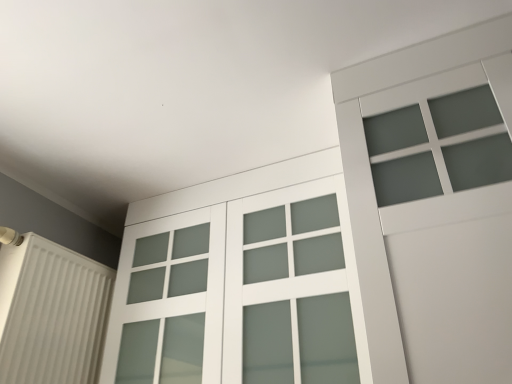
Question: Is satin white glass door at center in front of or behind white matte radiator at left in the image?

Choices:
 (A) behind
 (B) front

Answer: (B)

Question: Considering the positions of point (131, 314) and point (41, 244), is point (131, 314) closer or farther from the camera than point (41, 244)?

Choices:
 (A) farther
 (B) closer

Answer: (A)

Question: From a real-world perspective, is satin white glass door at center physically located above or below white matte radiator at left?

Choices:
 (A) below
 (B) above

Answer: (B)

Question: Is white matte radiator at left in front of or behind satin white glass door at center in the image?

Choices:
 (A) front
 (B) behind

Answer: (B)

Question: From the image's perspective, is white matte radiator at left positioned above or below satin white glass door at center?

Choices:
 (A) below
 (B) above

Answer: (A)

Question: Is white matte radiator at left taller or shorter than satin white glass door at center?

Choices:
 (A) short
 (B) tall

Answer: (A)

Question: From a real-world perspective, relative to satin white glass door at center, is white matte radiator at left vertically above or below?

Choices:
 (A) above
 (B) below

Answer: (B)